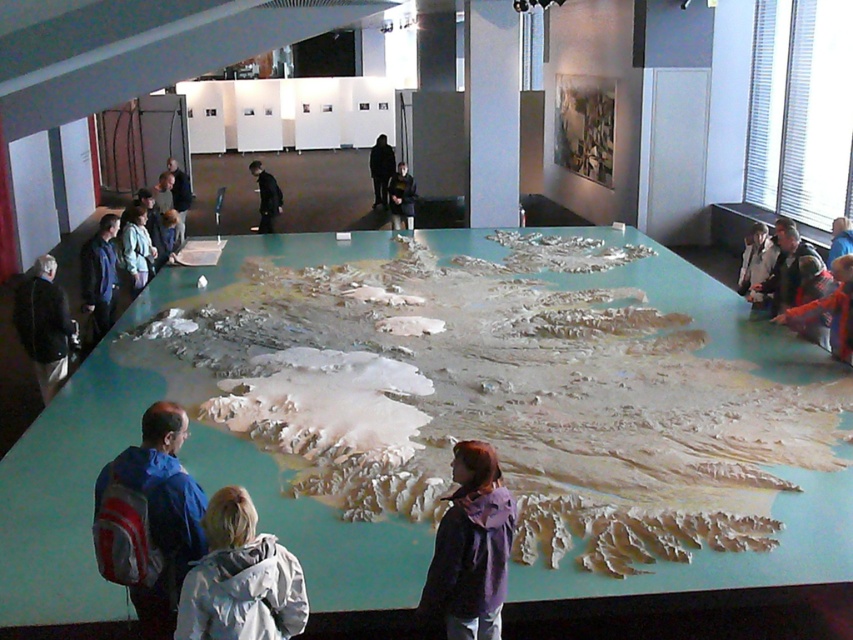
You are planning to place a new decorative item on the table between the purple matte jacket at center and the red plaid shirt at right. Considering their sizes, which of the two items has more space available next to it for placing the decorative item?

The purple matte jacket at center has a larger width than the red plaid shirt at right, so there is more space available next to it for placing the decorative item.

You are a photographer standing at the back of the room. You want to take a photo of the purple matte jacket at center and the red plaid shirt at right. Which object will appear smaller in your photo?

The purple matte jacket at center will appear smaller in the photo because it has a lesser height compared to the red plaid shirt at right.

You are an event organizer planning to place a 1.2 meter wide decorative banner between the red plaid shirt at right and the black matte jacket at center. Based on their widths, will the banner fit without overlapping either clothing item?

The red plaid shirt at right is narrower than the black matte jacket at center. Since the banner is 1.2 meters wide, it may not fit if the space between them is smaller than 1.2 meters. However, the question only provides information about their widths, not the distance between them. Therefore, we cannot determine if the banner will fit based solely on the given information.